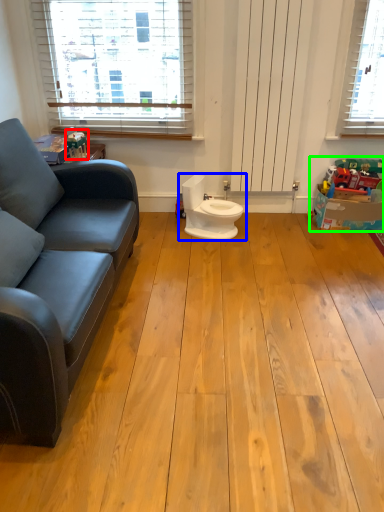
Question: Considering the real-world distances, which object is closest to toy (highlighted by a red box)? toilet (highlighted by a blue box) or toy (highlighted by a green box).

Choices:
 (A) toilet
 (B) toy

Answer: (A)